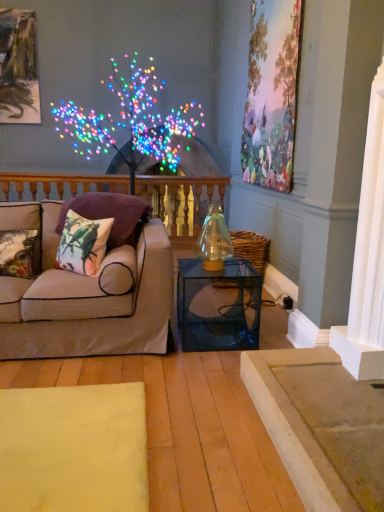
Locate an element on the screen. Image resolution: width=384 pixels, height=512 pixels. free point in front of beige fabric couch at left is located at coordinates (117, 414).